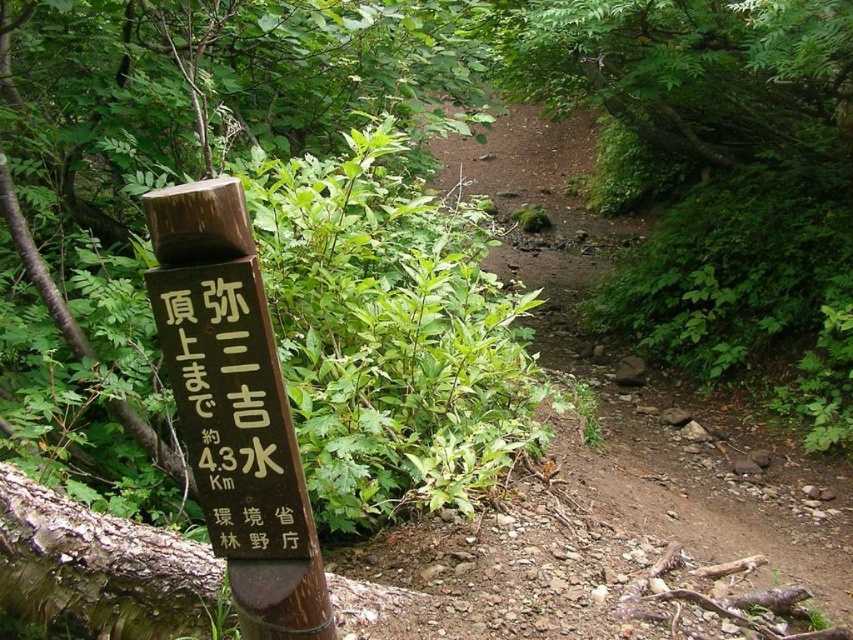
Does brown dirt trail at center have a larger size compared to brown wooden signpost at center-left?

Indeed, brown dirt trail at center has a larger size compared to brown wooden signpost at center-left.

Who is taller, brown dirt trail at center or brown wooden signpost at center-left?

Standing taller between the two is brown dirt trail at center.

Find the location of a particular element. The image size is (853, 640). brown dirt trail at center is located at coordinates (720, 493).

Which is more to the left, brown dirt trail at center or brown wooden signpost at left?

Positioned to the left is brown wooden signpost at left.

Which of these two, brown dirt trail at center or brown wooden signpost at left, stands taller?

With more height is brown dirt trail at center.

Which is in front, point (456, 148) or point (219, 381)?

Point (219, 381) is more forward.

This screenshot has width=853, height=640. I want to click on brown dirt trail at center, so click(x=720, y=493).

Between point (170, 202) and point (310, 547), which one is positioned in front?

Positioned in front is point (170, 202).

What do you see at coordinates (235, 408) in the screenshot?
I see `brown wooden signpost at left` at bounding box center [235, 408].

Between point (245, 212) and point (254, 416), which one is positioned in front?

Point (245, 212) is more forward.

Locate an element on the screen. This screenshot has width=853, height=640. brown wooden signpost at left is located at coordinates (235, 408).